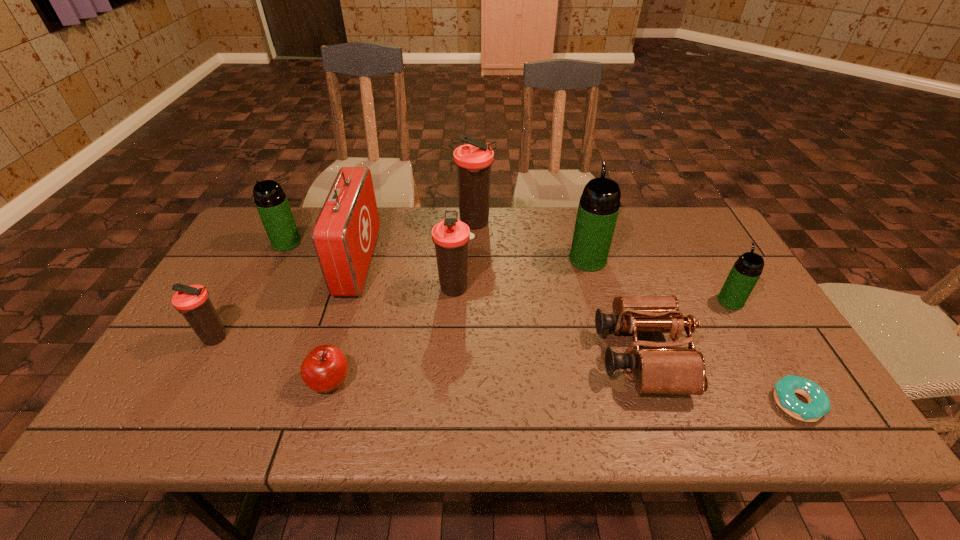
You are a GUI agent. You are given a task and a screenshot of the screen. Output one action in this format:
    pyautogui.click(x=<x>, y=<y>)
    Task: Click on the binoculars
    This screenshot has height=540, width=960.
    Given the screenshot: What is the action you would take?
    pyautogui.click(x=664, y=368)

Locate an element on the screen. The height and width of the screenshot is (540, 960). the second shortest object is located at coordinates (325, 368).

Identify the location of apple. This screenshot has width=960, height=540. (325, 368).

Locate an element on the screen. The height and width of the screenshot is (540, 960). doughnut is located at coordinates click(819, 404).

Find the location of a particular element. This screenshot has width=960, height=540. vacant space located 0.220m on the front of the farthest brown thermos bottle is located at coordinates (474, 284).

Find the location of a particular element. The height and width of the screenshot is (540, 960). vacant space located from the spout of the second thermos bottle from right to left is located at coordinates (578, 222).

Where is `vacant area located from the spout of the second thermos bottle from right to left`? The height and width of the screenshot is (540, 960). vacant area located from the spout of the second thermos bottle from right to left is located at coordinates (574, 211).

This screenshot has width=960, height=540. Find the location of `vacant region located 0.210m from the spout of the second thermos bottle from right to left`. vacant region located 0.210m from the spout of the second thermos bottle from right to left is located at coordinates (574, 209).

At what (x,y) coordinates should I click in order to perform the action: click on free spot located on the side of the red first-aid kit with the first aid cross symbol. Please return your answer as a coordinate pair (x, y). Looking at the image, I should click on (420, 262).

The height and width of the screenshot is (540, 960). I want to click on vacant space located 0.220m from the spout of the second smallest green thermos bottle, so click(x=255, y=303).